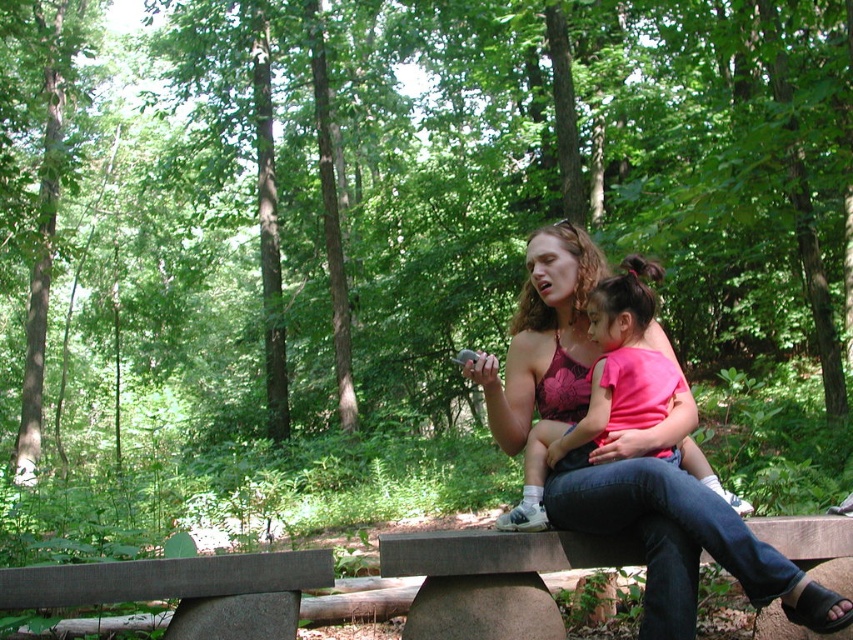
Question: Can you confirm if gray concrete bench at center is positioned below pink fabric baby at center?

Choices:
 (A) no
 (B) yes

Answer: (B)

Question: Which of the following is the closest to the observer?

Choices:
 (A) matte pink tank top at center
 (B) pink fabric baby at center

Answer: (A)

Question: Can you confirm if gray concrete bench at center is positioned to the right of pink fabric baby at center?

Choices:
 (A) yes
 (B) no

Answer: (B)

Question: Which of these objects is positioned farthest from the pink fabric baby at center?

Choices:
 (A) gray concrete bench at center
 (B) matte pink tank top at center

Answer: (A)

Question: Can you confirm if gray concrete bench at center is wider than pink fabric baby at center?

Choices:
 (A) no
 (B) yes

Answer: (B)

Question: Estimate the real-world distances between objects in this image. Which object is farther from the gray concrete bench at center?

Choices:
 (A) pink fabric baby at center
 (B) matte pink tank top at center

Answer: (A)